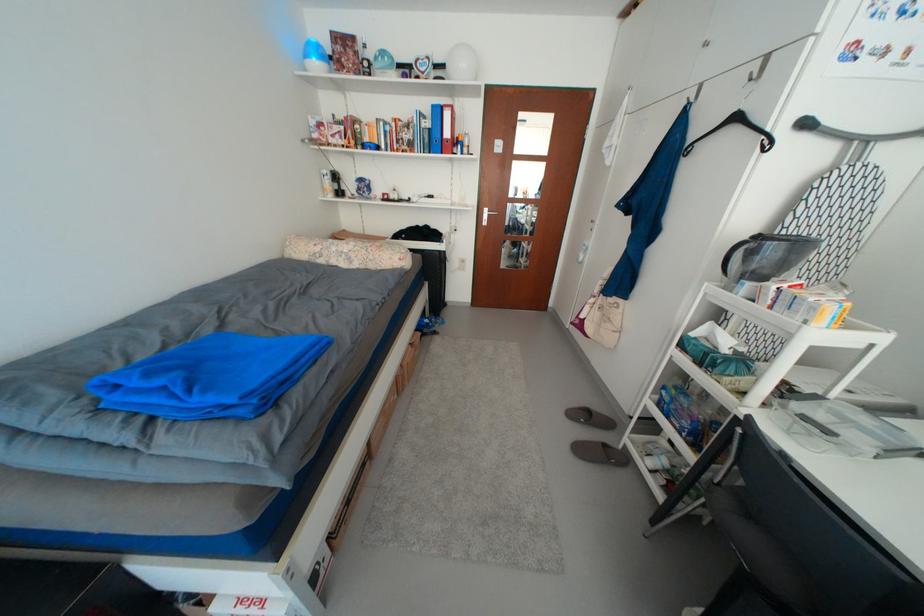
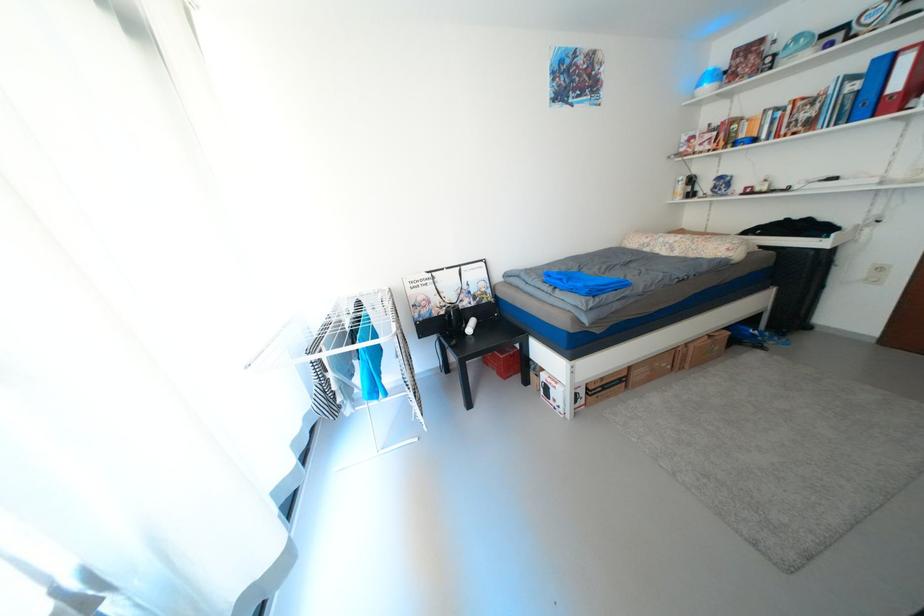
Find the pixel in the second image that matches pixel 419 346 in the first image.

(718, 338)